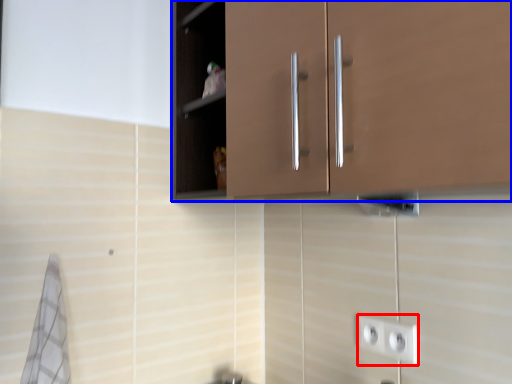
Question: Which object is further to the camera taking this photo, socket (highlighted by a red box) or cabinetry (highlighted by a blue box)?

Choices:
 (A) socket
 (B) cabinetry

Answer: (A)